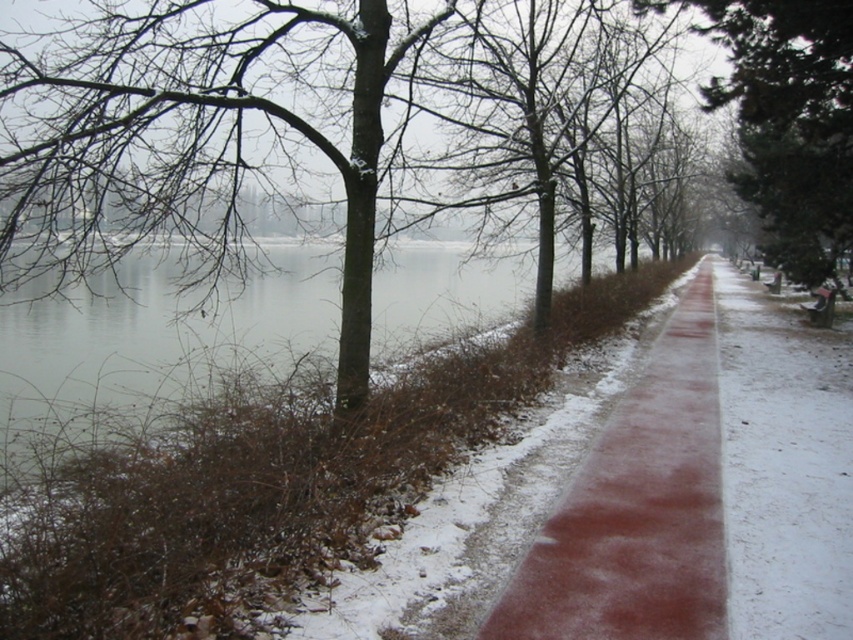
Is slick rubber path at center to the left of green textured tree at center from the viewer's perspective?

Yes, slick rubber path at center is to the left of green textured tree at center.

Measure the distance between slick rubber path at center and camera.

A distance of 3.98 meters exists between slick rubber path at center and camera.

Is point (821, 403) farther from camera compared to point (819, 212)?

No, (821, 403) is in front of (819, 212).

This screenshot has width=853, height=640. What are the coordinates of `slick rubber path at center` in the screenshot? It's located at (782, 465).

Is sanded concrete path at center bigger than green textured tree at center?

No.

Which is more to the left, sanded concrete path at center or green textured tree at center?

From the viewer's perspective, sanded concrete path at center appears more on the left side.

This screenshot has height=640, width=853. What do you see at coordinates (637, 508) in the screenshot?
I see `sanded concrete path at center` at bounding box center [637, 508].

The image size is (853, 640). Identify the location of sanded concrete path at center. (637, 508).

Is sanded concrete path at center below slick rubber path at center?

Yes, sanded concrete path at center is below slick rubber path at center.

In the scene shown: Is sanded concrete path at center smaller than slick rubber path at center?

Indeed, sanded concrete path at center has a smaller size compared to slick rubber path at center.

Who is more distant from viewer, (653,394) or (770,481)?

Positioned behind is point (653,394).

Find the location of a particular element. The width and height of the screenshot is (853, 640). sanded concrete path at center is located at coordinates (x=637, y=508).